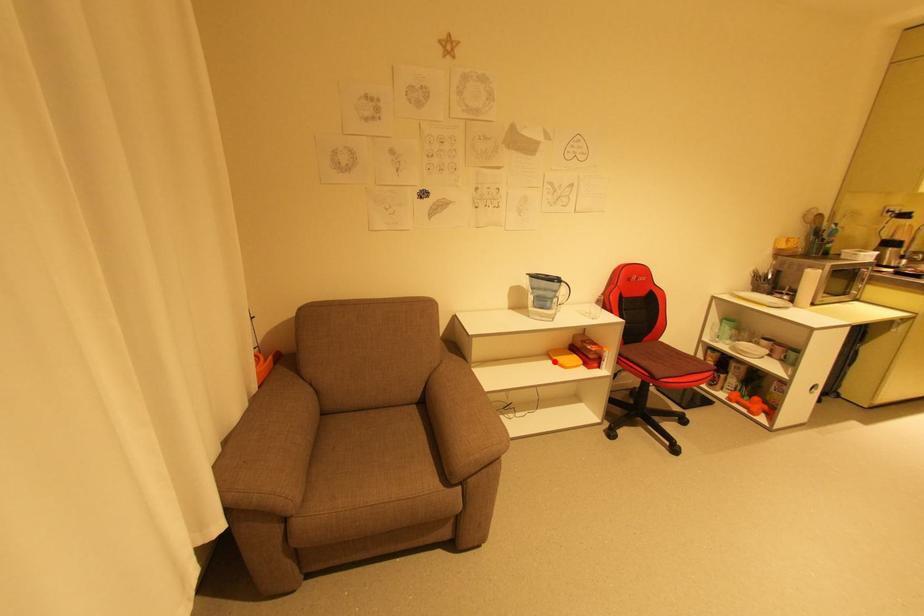
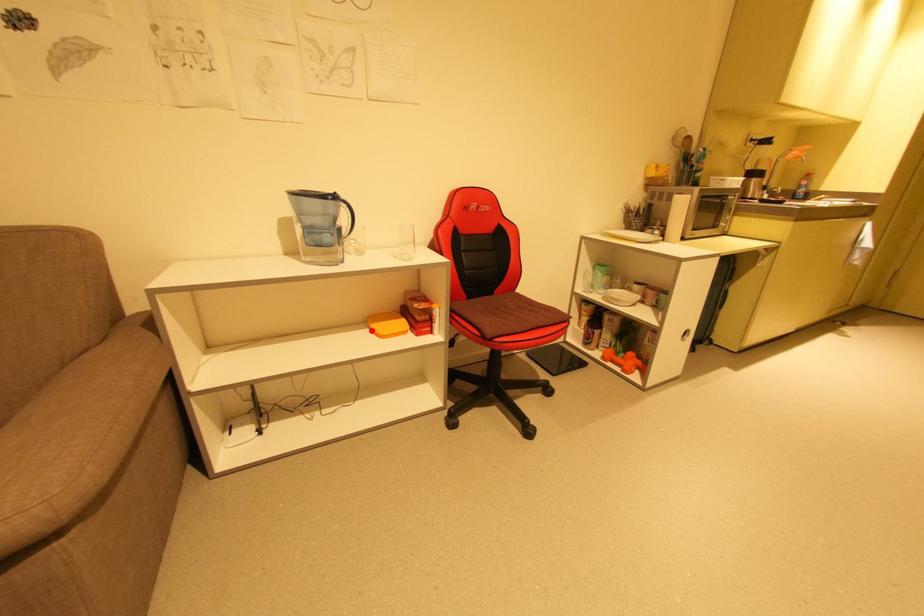
I am providing you with two images of the same scene from different viewpoints. A red point is marked on the first image and another point is marked on the second image. Do the highlighted points in image1 and image2 indicate the same real-world spot?

Yes